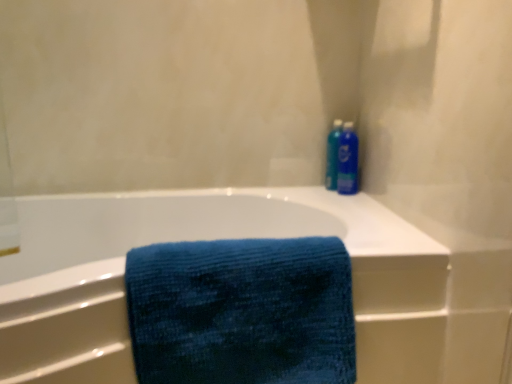
Consider the image. What is the approximate width of blue textured towel at center?

It is 12.20 inches.

The width and height of the screenshot is (512, 384). I want to click on blue fabric towel at center, so click(206, 239).

What do you see at coordinates (206, 239) in the screenshot?
I see `blue fabric towel at center` at bounding box center [206, 239].

Consider the image. In order to face blue glossy spray can at upper right, should I rotate leftwards or rightwards?

Rotate right and turn 11.876 degrees.

What are the coordinates of `blue plastic bottle at upper right` in the screenshot? It's located at (333, 155).

Can blue glossy spray can at upper right be found inside blue fabric towel at center?

No, blue fabric towel at center does not contain blue glossy spray can at upper right.

Between blue fabric towel at center and blue glossy spray can at upper right, which one has less height?

blue glossy spray can at upper right is shorter.

In terms of width, does blue fabric towel at center look wider or thinner when compared to blue glossy spray can at upper right?

In the image, blue fabric towel at center appears to be wider than blue glossy spray can at upper right.

At what (x,y) coordinates should I click in order to perform the action: click on towel above the blue fabric towel at center (from a real-world perspective). Please return your answer as a coordinate pair (x, y). This screenshot has width=512, height=384. Looking at the image, I should click on (242, 312).

Which of these two, blue fabric towel at center or blue textured towel at center, is bigger?

Bigger between the two is blue fabric towel at center.

Considering the sizes of blue fabric towel at center and blue textured towel at center in the image, is blue fabric towel at center wider or thinner than blue textured towel at center?

In the image, blue fabric towel at center appears to be wider than blue textured towel at center.

From the picture: Between blue textured towel at center and blue fabric towel at center, which one appears on the left side from the viewer's perspective?

blue fabric towel at center is more to the left.

Can you confirm if blue textured towel at center is thinner than blue fabric towel at center?

Indeed, blue textured towel at center has a lesser width compared to blue fabric towel at center.

In the image, is blue textured towel at center positioned in front of or behind blue fabric towel at center?

In the image, blue textured towel at center appears behind blue fabric towel at center.

Is blue plastic bottle at upper right inside the boundaries of blue textured towel at center, or outside?

blue plastic bottle at upper right exists outside the volume of blue textured towel at center.

From the image's perspective, between blue plastic bottle at upper right and blue textured towel at center, which one is located above?

blue plastic bottle at upper right is shown above in the image.

Which is in front, point (327, 153) or point (279, 263)?

Positioned in front is point (279, 263).

From a real-world perspective, between blue plastic bottle at upper right and blue textured towel at center, who is vertically higher?

In real-world perspective, blue plastic bottle at upper right is above.

Considering the sizes of objects blue glossy spray can at upper right and blue textured towel at center in the image provided, who is shorter, blue glossy spray can at upper right or blue textured towel at center?

Standing shorter between the two is blue glossy spray can at upper right.

Is blue textured towel at center a part of blue glossy spray can at upper right?

No, blue textured towel at center is not inside blue glossy spray can at upper right.

From the image's perspective, is blue glossy spray can at upper right below blue textured towel at center?

Incorrect, from the image's perspective, blue glossy spray can at upper right is higher than blue textured towel at center.

Between blue glossy spray can at upper right and blue textured towel at center, which one appears on the left side from the viewer's perspective?

Positioned to the left is blue textured towel at center.

In the scene shown: Is blue glossy spray can at upper right closer to the viewer compared to blue plastic bottle at upper right?

That is True.

In the scene shown: How far apart are blue glossy spray can at upper right and blue plastic bottle at upper right?

blue glossy spray can at upper right is 1.62 inches away from blue plastic bottle at upper right.

I want to click on cleaning product on the right of blue plastic bottle at upper right, so click(x=348, y=160).

Who is bigger, blue glossy spray can at upper right or blue plastic bottle at upper right?

blue glossy spray can at upper right.

Considering the positions of objects blue plastic bottle at upper right and blue glossy spray can at upper right in the image provided, who is more to the right, blue plastic bottle at upper right or blue glossy spray can at upper right?

blue glossy spray can at upper right is more to the right.

Is blue plastic bottle at upper right positioned before blue glossy spray can at upper right?

No, blue plastic bottle at upper right is further to the viewer.

From a real-world perspective, does blue plastic bottle at upper right stand above blue glossy spray can at upper right?

Yes, from a real-world perspective, blue plastic bottle at upper right is on top of blue glossy spray can at upper right.

Does blue plastic bottle at upper right turn towards blue glossy spray can at upper right?

Yes.

Image resolution: width=512 pixels, height=384 pixels. Find the location of `bathtub that appears below the blue glossy spray can at upper right (from a real-world perspective)`. bathtub that appears below the blue glossy spray can at upper right (from a real-world perspective) is located at coordinates (206, 239).

Locate an element on the screen. towel behind the blue fabric towel at center is located at coordinates (242, 312).

From the image, which object appears to be nearer to blue glossy spray can at upper right, blue fabric towel at center or blue plastic bottle at upper right?

blue plastic bottle at upper right.

Based on their spatial positions, is blue glossy spray can at upper right or blue fabric towel at center further from blue plastic bottle at upper right?

The object further to blue plastic bottle at upper right is blue fabric towel at center.

Estimate the real-world distances between objects in this image. Which object is closer to blue plastic bottle at upper right, blue textured towel at center or blue glossy spray can at upper right?

blue glossy spray can at upper right is positioned closer to the anchor blue plastic bottle at upper right.

When comparing their distances from blue plastic bottle at upper right, does blue textured towel at center or blue fabric towel at center seem further?

blue textured towel at center is positioned further to the anchor blue plastic bottle at upper right.

When comparing their distances from blue fabric towel at center, does blue glossy spray can at upper right or blue plastic bottle at upper right seem closer?

Among the two, blue glossy spray can at upper right is located nearer to blue fabric towel at center.

Looking at the image, which one is located further to blue textured towel at center, blue fabric towel at center or blue plastic bottle at upper right?

Based on the image, blue plastic bottle at upper right appears to be further to blue textured towel at center.

Looking at the image, which one is located further to blue fabric towel at center, blue glossy spray can at upper right or blue textured towel at center?

blue glossy spray can at upper right is positioned further to the anchor blue fabric towel at center.

Looking at the image, which one is located closer to blue textured towel at center, blue fabric towel at center or blue glossy spray can at upper right?

blue fabric towel at center is closer to blue textured towel at center.

Identify the location of towel between blue fabric towel at center and blue glossy spray can at upper right from front to back. (242, 312).

Find the location of `towel positioned between blue fabric towel at center and blue plastic bottle at upper right from near to far`. towel positioned between blue fabric towel at center and blue plastic bottle at upper right from near to far is located at coordinates (242, 312).

You are a GUI agent. You are given a task and a screenshot of the screen. Output one action in this format:
    pyautogui.click(x=<x>, y=<y>)
    Task: Click on the cleaning product positioned between blue textured towel at center and blue plastic bottle at upper right from near to far
    This screenshot has width=512, height=384.
    Given the screenshot: What is the action you would take?
    pyautogui.click(x=348, y=160)

You are a GUI agent. You are given a task and a screenshot of the screen. Output one action in this format:
    pyautogui.click(x=<x>, y=<y>)
    Task: Click on the cleaning product positioned between blue fabric towel at center and blue plastic bottle at upper right from near to far
    
    Given the screenshot: What is the action you would take?
    pyautogui.click(x=348, y=160)